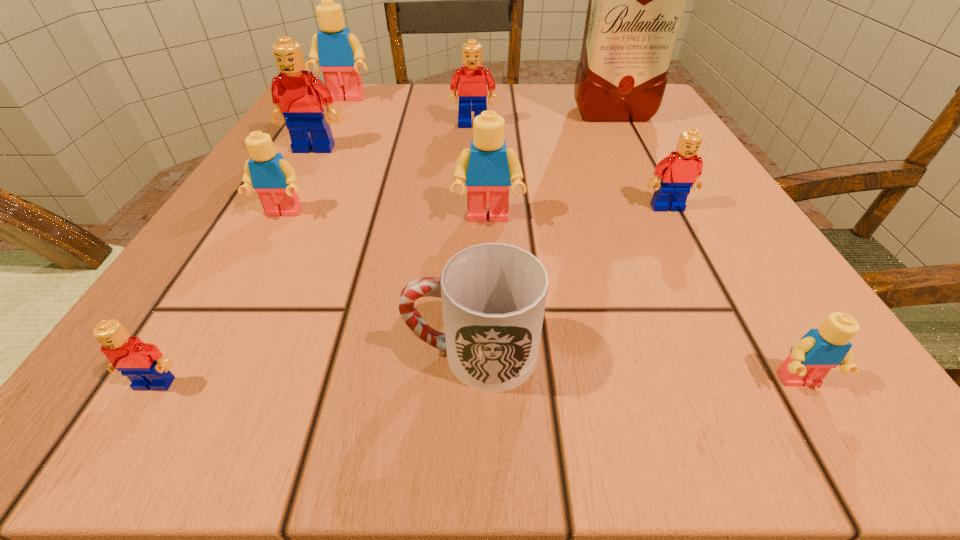
At what (x,y) coordinates should I click in order to perform the action: click on the tallest object. Please return your answer as a coordinate pair (x, y). Looking at the image, I should click on coord(637,0).

Where is `the farthest Lego`? The image size is (960, 540). the farthest Lego is located at coordinates (339, 53).

You are a GUI agent. You are given a task and a screenshot of the screen. Output one action in this format:
    pyautogui.click(x=<x>, y=<y>)
    Task: Click on the farthest yellow Lego
    This screenshot has width=960, height=540.
    Given the screenshot: What is the action you would take?
    pyautogui.click(x=339, y=53)

Identify the location of the second farthest red Lego. The height and width of the screenshot is (540, 960). (300, 98).

In order to click on the biggest red Lego in this screenshot , I will do `click(300, 98)`.

The height and width of the screenshot is (540, 960). I want to click on the second farthest Lego, so click(x=472, y=90).

Where is `the farthest red Lego`? The width and height of the screenshot is (960, 540). the farthest red Lego is located at coordinates (472, 90).

Where is `the second biggest yellow Lego`? This screenshot has width=960, height=540. the second biggest yellow Lego is located at coordinates (488, 168).

This screenshot has height=540, width=960. What are the coordinates of `the third biggest yellow Lego` in the screenshot? It's located at (274, 179).

Image resolution: width=960 pixels, height=540 pixels. In order to click on the rightmost red Lego in this screenshot , I will do `click(679, 172)`.